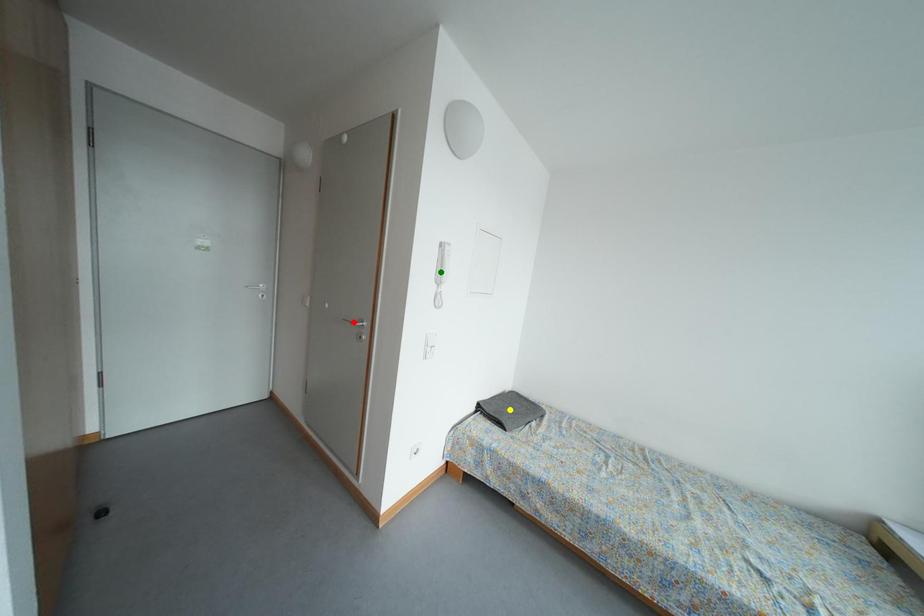
Order these from nearest to farthest:
A) green point
B) yellow point
C) red point

red point, green point, yellow point